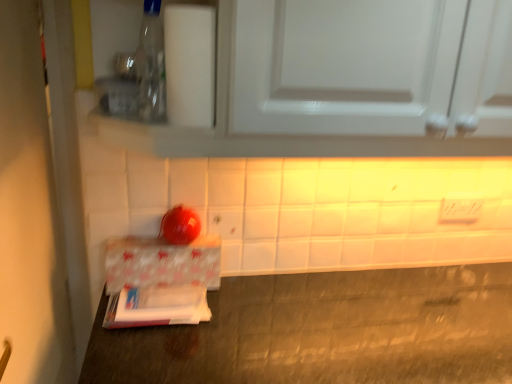
Locate an element on the screen. The width and height of the screenshot is (512, 384). white plastic electric outlet at center is located at coordinates (460, 210).

At what (x,y) coordinates should I click in order to perform the action: click on transparent plastic bottle at upper left. Please return your answer as a coordinate pair (x, y). Image resolution: width=512 pixels, height=384 pixels. Looking at the image, I should click on tap(151, 65).

This screenshot has width=512, height=384. What do you see at coordinates (350, 82) in the screenshot?
I see `white glossy cabinet at upper center` at bounding box center [350, 82].

Image resolution: width=512 pixels, height=384 pixels. Describe the element at coordinates (162, 262) in the screenshot. I see `patterned paperboard at lower left` at that location.

You are a GUI agent. You are given a task and a screenshot of the screen. Output one action in this format:
    pyautogui.click(x=<x>, y=<y>)
    Task: Click on the white plastic electric outlet at center
    
    Given the screenshot: What is the action you would take?
    pyautogui.click(x=460, y=210)

Consider the image. From a real-world perspective, who is located higher, white glossy cabinet at upper center or transparent plastic bottle at upper left?

From a 3D spatial view, transparent plastic bottle at upper left is above.

From the image's perspective, which one is positioned higher, white glossy cabinet at upper center or transparent plastic bottle at upper left?

transparent plastic bottle at upper left appears higher in the image.

Which of these two, white glossy cabinet at upper center or transparent plastic bottle at upper left, is bigger?

white glossy cabinet at upper center is bigger.

Would you say white glossy cabinet at upper center contains transparent plastic bottle at upper left?

Yes, white glossy cabinet at upper center is surrounding transparent plastic bottle at upper left.

Based on the photo, is patterned paperboard at lower left positioned with its back to white glossy cabinet at upper center?

No, patterned paperboard at lower left is not facing the opposite direction of white glossy cabinet at upper center.

Is patterned paperboard at lower left bigger or smaller than white glossy cabinet at upper center?

Considering their sizes, patterned paperboard at lower left takes up less space than white glossy cabinet at upper center.

From the image's perspective, which object appears higher, patterned paperboard at lower left or white glossy cabinet at upper center?

white glossy cabinet at upper center is shown above in the image.

How different are the orientations of patterned paperboard at lower left and white glossy cabinet at upper center in degrees?

The angle between the facing direction of patterned paperboard at lower left and the facing direction of white glossy cabinet at upper center is 0.562 degrees.

Which is more distant, (156, 36) or (442, 212)?

Positioned behind is point (442, 212).

Is transparent plastic bottle at upper left wider than white plastic electric outlet at center?

Yes, transparent plastic bottle at upper left is wider than white plastic electric outlet at center.

From the image's perspective, does transparent plastic bottle at upper left appear lower than white plastic electric outlet at center?

No, from the image's perspective, transparent plastic bottle at upper left is not below white plastic electric outlet at center.

Can you tell me how much transparent plastic bottle at upper left and white plastic electric outlet at center differ in facing direction?

The facing directions of transparent plastic bottle at upper left and white plastic electric outlet at center are 0.54 degrees apart.

From a real-world perspective, who is located higher, white plastic electric outlet at center or patterned paperboard at lower left?

white plastic electric outlet at center.

From the image's perspective, between white plastic electric outlet at center and patterned paperboard at lower left, which one is located above?

white plastic electric outlet at center is shown above in the image.

Is white plastic electric outlet at center smaller than patterned paperboard at lower left?

Indeed, white plastic electric outlet at center has a smaller size compared to patterned paperboard at lower left.

Which of these two, white plastic electric outlet at center or patterned paperboard at lower left, stands taller?

patterned paperboard at lower left is taller.

From the image's perspective, which one is positioned higher, white glossy cabinet at upper center or white glossy door at left?

white glossy cabinet at upper center, from the image's perspective.

Can you confirm if white glossy cabinet at upper center is bigger than white glossy door at left?

Yes.

Is white glossy door at left at the back of white glossy cabinet at upper center?

That's not correct — white glossy cabinet at upper center is not looking away from white glossy door at left.

From the image's perspective, is white glossy cabinet at upper center on patterned paperboard at lower left?

Yes, from the image's perspective, white glossy cabinet at upper center is over patterned paperboard at lower left.

Which of these two, white glossy cabinet at upper center or patterned paperboard at lower left, is smaller?

patterned paperboard at lower left.

Could you tell me if white glossy cabinet at upper center is turned towards patterned paperboard at lower left?

No, white glossy cabinet at upper center is not facing towards patterned paperboard at lower left.

Considering the relative positions of white glossy cabinet at upper center and patterned paperboard at lower left in the image provided, is white glossy cabinet at upper center to the left of patterned paperboard at lower left from the viewer's perspective?

Incorrect, white glossy cabinet at upper center is not on the left side of patterned paperboard at lower left.

Based on the photo, considering the sizes of objects transparent plastic bottle at upper left and white glossy cabinet at upper center in the image provided, who is wider, transparent plastic bottle at upper left or white glossy cabinet at upper center?

Wider between the two is white glossy cabinet at upper center.

How distant is transparent plastic bottle at upper left from white glossy cabinet at upper center?

They are 14.03 inches apart.

From the picture: Is transparent plastic bottle at upper left completely or partially outside of white glossy cabinet at upper center?

That's incorrect, transparent plastic bottle at upper left is not completely outside white glossy cabinet at upper center.

From a real-world perspective, is transparent plastic bottle at upper left physically located above or below white glossy cabinet at upper center?

From a real-world perspective, transparent plastic bottle at upper left is physically above white glossy cabinet at upper center.

Find the location of a particular element. The width and height of the screenshot is (512, 384). bottle on the left of the white glossy cabinet at upper center is located at coordinates (151, 65).

Where is `cabinetry above the patterned paperboard at lower left (from a real-world perspective)`? cabinetry above the patterned paperboard at lower left (from a real-world perspective) is located at coordinates (350, 82).

Looking at the image, which one is located further to patterned paperboard at lower left, white plastic electric outlet at center or white glossy cabinet at upper center?

white plastic electric outlet at center.

Based on their spatial positions, is white glossy cabinet at upper center or white plastic electric outlet at center closer to patterned paperboard at lower left?

white glossy cabinet at upper center is closer to patterned paperboard at lower left.

Which object lies further to the anchor point transparent plastic bottle at upper left, white glossy door at left or white glossy cabinet at upper center?

Among the two, white glossy door at left is located further to transparent plastic bottle at upper left.

Considering their positions, is patterned paperboard at lower left positioned closer to white glossy door at left than white plastic electric outlet at center?

patterned paperboard at lower left.

Looking at the image, which one is located closer to white glossy cabinet at upper center, transparent plastic bottle at upper left or white plastic electric outlet at center?

Based on the image, transparent plastic bottle at upper left appears to be nearer to white glossy cabinet at upper center.

Considering their positions, is white plastic electric outlet at center positioned closer to patterned paperboard at lower left than transparent plastic bottle at upper left?

The object closer to patterned paperboard at lower left is transparent plastic bottle at upper left.

Estimate the real-world distances between objects in this image. Which object is closer to white plastic electric outlet at center, patterned paperboard at lower left or white glossy cabinet at upper center?

white glossy cabinet at upper center lies closer to white plastic electric outlet at center than the other object.

From the image, which object appears to be farther from transparent plastic bottle at upper left, white plastic electric outlet at center or patterned paperboard at lower left?

white plastic electric outlet at center is positioned further to the anchor transparent plastic bottle at upper left.

You are a GUI agent. You are given a task and a screenshot of the screen. Output one action in this format:
    pyautogui.click(x=<x>, y=<y>)
    Task: Click on the cabinetry between white glossy door at left and white plastic electric outlet at center in the horizontal direction
    The image size is (512, 384).
    Given the screenshot: What is the action you would take?
    pyautogui.click(x=350, y=82)

The width and height of the screenshot is (512, 384). In order to click on bottle located between white glossy door at left and white plastic electric outlet at center in the left-right direction in this screenshot , I will do `click(151, 65)`.

Locate an element on the screen. The height and width of the screenshot is (384, 512). cabinetry that lies between transparent plastic bottle at upper left and patterned paperboard at lower left from top to bottom is located at coordinates (350, 82).

Where is `cardboard box between transparent plastic bottle at upper left and white plastic electric outlet at center`? This screenshot has width=512, height=384. cardboard box between transparent plastic bottle at upper left and white plastic electric outlet at center is located at coordinates (162, 262).